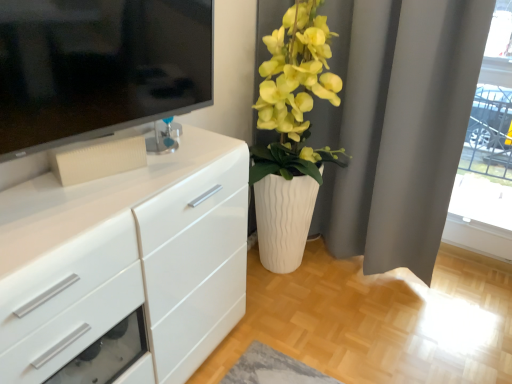
Question: Is matte white vase at center right touching transparent glass door at upper right?

Choices:
 (A) no
 (B) yes

Answer: (A)

Question: From a real-world perspective, is matte white vase at center right below transparent glass door at upper right?

Choices:
 (A) no
 (B) yes

Answer: (B)

Question: Is matte white vase at center right positioned behind transparent glass door at upper right?

Choices:
 (A) no
 (B) yes

Answer: (A)

Question: From the image's perspective, is matte white vase at center right located beneath transparent glass door at upper right?

Choices:
 (A) no
 (B) yes

Answer: (B)

Question: Does matte white vase at center right have a lesser height compared to transparent glass door at upper right?

Choices:
 (A) yes
 (B) no

Answer: (B)

Question: Considering the relative positions of matte white vase at center right and transparent glass door at upper right in the image provided, is matte white vase at center right in front of transparent glass door at upper right?

Choices:
 (A) no
 (B) yes

Answer: (B)

Question: Is matte white vase at center right further to camera compared to white matte curtain at upper right?

Choices:
 (A) yes
 (B) no

Answer: (B)

Question: Are matte white vase at center right and white matte curtain at upper right far apart?

Choices:
 (A) yes
 (B) no

Answer: (B)

Question: From the image's perspective, does matte white vase at center right appear higher than white matte curtain at upper right?

Choices:
 (A) yes
 (B) no

Answer: (B)

Question: Does matte white vase at center right turn towards white matte curtain at upper right?

Choices:
 (A) no
 (B) yes

Answer: (A)

Question: Is matte white vase at center right completely or partially outside of white matte curtain at upper right?

Choices:
 (A) yes
 (B) no

Answer: (A)

Question: Is matte white vase at center right turned away from white matte curtain at upper right?

Choices:
 (A) yes
 (B) no

Answer: (B)

Question: Is white glossy chest of drawers at left facing towards white matte curtain at upper right?

Choices:
 (A) no
 (B) yes

Answer: (A)